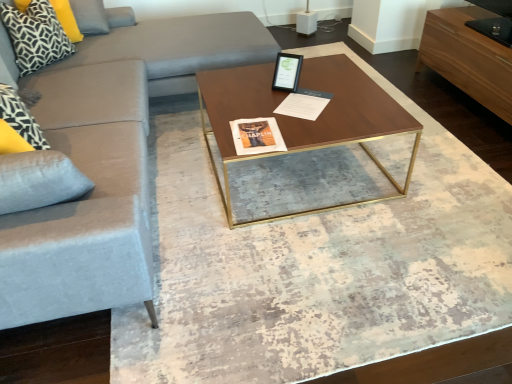
I want to click on free space in front of walnut wood coffee table at center, so [x=319, y=271].